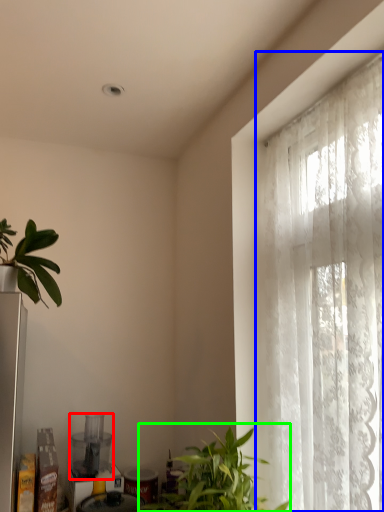
Question: Estimate the real-world distances between objects in this image. Which object is closer to appliance (highlighted by a red box), window (highlighted by a blue box) or houseplant (highlighted by a green box)?

Choices:
 (A) window
 (B) houseplant

Answer: (B)